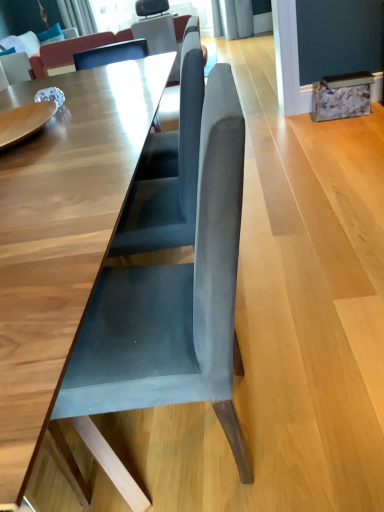
The height and width of the screenshot is (512, 384). Find the location of `blank area beneath suede gray chair at center (from a real-world perspective)`. blank area beneath suede gray chair at center (from a real-world perspective) is located at coordinates (183, 440).